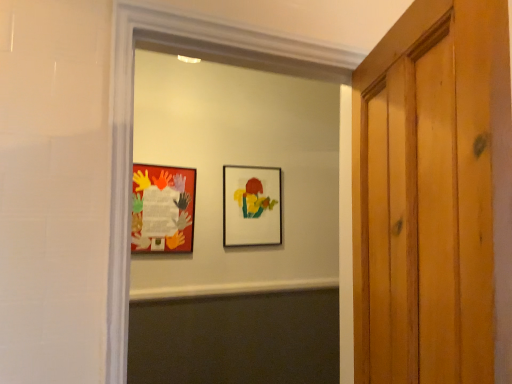
Question: Is the depth of matte plastic picture frame at center, which is counted as the second picture frame, starting from the front, less than that of matte paper collage at left, marked as the second picture frame in a back-to-front arrangement?

Choices:
 (A) no
 (B) yes

Answer: (A)

Question: Is matte plastic picture frame at center, marked as the 2th picture frame in a left-to-right arrangement, thinner than matte paper collage at left, marked as the second picture frame in a back-to-front arrangement?

Choices:
 (A) no
 (B) yes

Answer: (A)

Question: Is matte paper collage at left, marked as the second picture frame in a back-to-front arrangement, at the back of matte plastic picture frame at center, which is counted as the second picture frame, starting from the front?

Choices:
 (A) no
 (B) yes

Answer: (A)

Question: Considering the relative sizes of matte plastic picture frame at center, marked as the 2th picture frame in a left-to-right arrangement, and matte paper collage at left, which appears as the 1th picture frame when viewed from the front, in the image provided, is matte plastic picture frame at center, marked as the 2th picture frame in a left-to-right arrangement, wider than matte paper collage at left, which appears as the 1th picture frame when viewed from the front,?

Choices:
 (A) yes
 (B) no

Answer: (A)

Question: Can you confirm if matte plastic picture frame at center, the 1th picture frame in the back-to-front sequence, is taller than matte paper collage at left, which appears as the 1th picture frame when viewed from the front?

Choices:
 (A) no
 (B) yes

Answer: (B)

Question: Does matte plastic picture frame at center, which is counted as the second picture frame, starting from the front, have a larger size compared to matte paper collage at left, which appears as the 1th picture frame when viewed from the front?

Choices:
 (A) no
 (B) yes

Answer: (B)

Question: Is matte paper collage at center at the right side of matte plastic picture frame at center, the 1th picture frame in the back-to-front sequence?

Choices:
 (A) yes
 (B) no

Answer: (A)

Question: Does matte paper collage at center lie behind matte plastic picture frame at center, which is counted as the second picture frame, starting from the front?

Choices:
 (A) yes
 (B) no

Answer: (B)

Question: From a real-world perspective, does matte paper collage at center stand above matte plastic picture frame at center, the 1th picture frame in the back-to-front sequence?

Choices:
 (A) yes
 (B) no

Answer: (B)

Question: Is matte plastic picture frame at center, the 1th picture frame in the back-to-front sequence, a part of matte paper collage at center?

Choices:
 (A) no
 (B) yes

Answer: (A)

Question: Can you confirm if matte paper collage at center is thinner than matte plastic picture frame at center, which is the first picture frame in right-to-left order?

Choices:
 (A) no
 (B) yes

Answer: (A)

Question: Can you confirm if matte paper collage at center is shorter than matte plastic picture frame at center, which is the first picture frame in right-to-left order?

Choices:
 (A) no
 (B) yes

Answer: (A)

Question: From a real-world perspective, is matte paper collage at center over matte paper collage at left, the 2th picture frame when ordered from right to left?

Choices:
 (A) yes
 (B) no

Answer: (B)